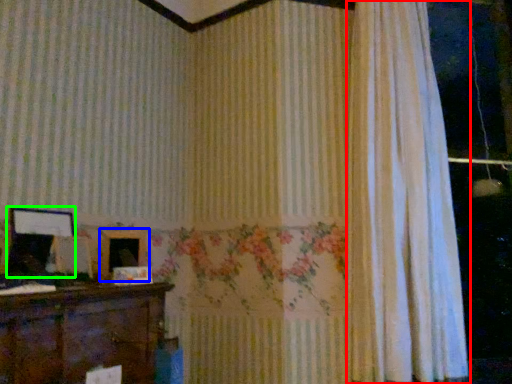
Question: Which object is positioned closest to curtain (highlighted by a red box)? Select from picture frame (highlighted by a blue box) and picture frame (highlighted by a green box).

Choices:
 (A) picture frame
 (B) picture frame

Answer: (A)